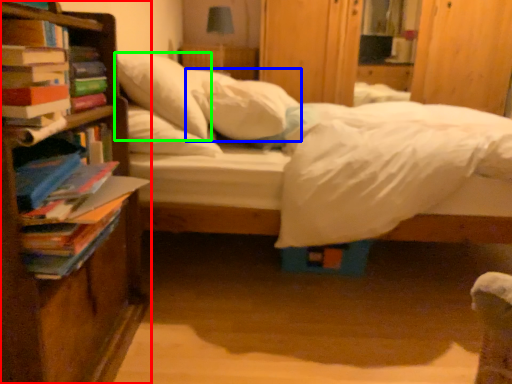
Question: Which is farther away from bookcase (highlighted by a red box)? pillow (highlighted by a blue box) or pillow (highlighted by a green box)?

Choices:
 (A) pillow
 (B) pillow

Answer: (A)